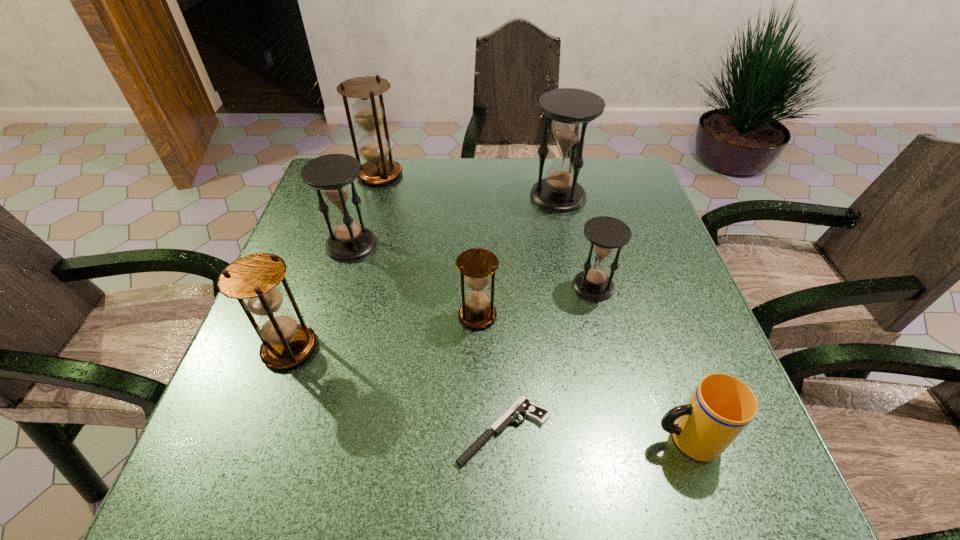
Image resolution: width=960 pixels, height=540 pixels. What are the coordinates of `the shortest object` in the screenshot? It's located at (523, 405).

This screenshot has height=540, width=960. Find the location of `black pistol`. black pistol is located at coordinates (523, 405).

At what (x,y) coordinates should I click in order to perform the action: click on vacant space situated on the left of the farthest black hourglass. Please return your answer as a coordinate pair (x, y). The height and width of the screenshot is (540, 960). Looking at the image, I should click on (476, 197).

You are a GUI agent. You are given a task and a screenshot of the screen. Output one action in this format:
    pyautogui.click(x=<x>, y=<y>)
    Task: Click on the vacant space located on the left of the farthest brown hourglass
    Image resolution: width=960 pixels, height=540 pixels.
    Given the screenshot: What is the action you would take?
    pyautogui.click(x=326, y=174)

This screenshot has width=960, height=540. I want to click on vacant region located 0.190m on the front of the leftmost black hourglass, so click(326, 327).

Locate an element on the screen. The height and width of the screenshot is (540, 960). vacant region located 0.120m on the front of the second biggest brown hourglass is located at coordinates (259, 433).

The image size is (960, 540). Find the location of `vacant region located on the right of the smallest black hourglass`. vacant region located on the right of the smallest black hourglass is located at coordinates (667, 286).

Find the location of `free region located 0.190m on the back of the smallest brown hourglass`. free region located 0.190m on the back of the smallest brown hourglass is located at coordinates (478, 243).

The height and width of the screenshot is (540, 960). Identify the location of free region located 0.270m on the side of the seventh tallest object with the handle. (492, 438).

Identify the location of free region located on the side of the seventh tallest object with the handle. (503, 438).